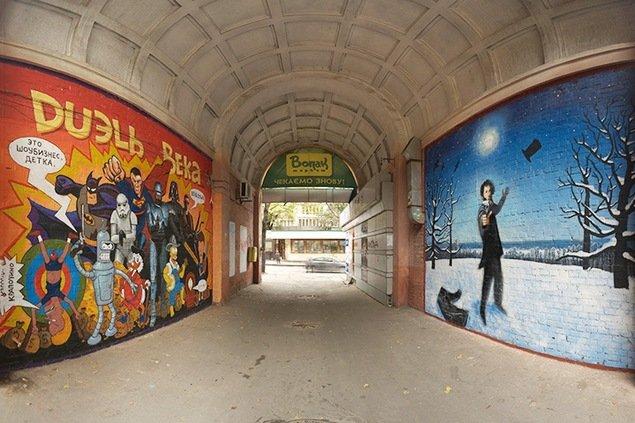
Find the location of a particular element. The height and width of the screenshot is (423, 635). ceiling is located at coordinates (311, 42).